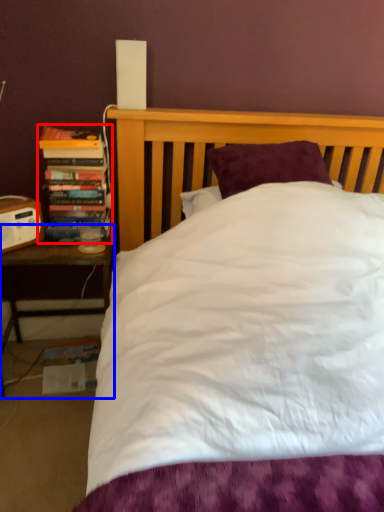
Question: Which point is further to the camera, book (highlighted by a red box) or nightstand (highlighted by a blue box)?

Choices:
 (A) book
 (B) nightstand

Answer: (A)